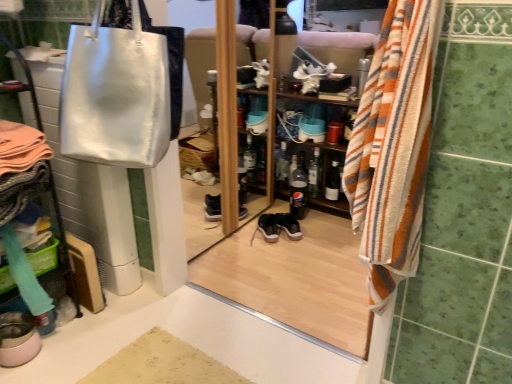
Question: Is the position of matte silver bag at upper left more distant than that of black glass bottle at center, the fourth bottle when ordered from left to right?

Choices:
 (A) yes
 (B) no

Answer: (B)

Question: Is matte silver bag at upper left to the left of black glass bottle at center, the fourth bottle when ordered from left to right, from the viewer's perspective?

Choices:
 (A) no
 (B) yes

Answer: (B)

Question: From the image's perspective, is matte silver bag at upper left on black glass bottle at center, the fourth bottle when ordered from left to right?

Choices:
 (A) no
 (B) yes

Answer: (A)

Question: From a real-world perspective, is matte silver bag at upper left positioned over black glass bottle at center, the first bottle viewed from the right, based on gravity?

Choices:
 (A) yes
 (B) no

Answer: (A)

Question: Can you confirm if matte silver bag at upper left is wider than black glass bottle at center, the first bottle viewed from the right?

Choices:
 (A) no
 (B) yes

Answer: (B)

Question: In the image, is clear glass bottle at center, the third bottle viewed from the left, on the left side or the right side of beige textured bath mat at lower center?

Choices:
 (A) right
 (B) left

Answer: (A)

Question: From the image's perspective, is clear glass bottle at center, the third bottle viewed from the left, located above or below beige textured bath mat at lower center?

Choices:
 (A) above
 (B) below

Answer: (A)

Question: Looking at their shapes, would you say clear glass bottle at center, which is the 2th bottle in right-to-left order, is wider or thinner than beige textured bath mat at lower center?

Choices:
 (A) thin
 (B) wide

Answer: (A)

Question: Is clear glass bottle at center, which is the 2th bottle in right-to-left order, taller or shorter than beige textured bath mat at lower center?

Choices:
 (A) short
 (B) tall

Answer: (B)

Question: From a real-world perspective, is clear glass bottle at center, which is the 2th bottle in right-to-left order, above or below clear glass bottle at center, placed as the fourth bottle when sorted from right to left?

Choices:
 (A) below
 (B) above

Answer: (A)

Question: In the image, is clear glass bottle at center, which is the 2th bottle in right-to-left order, on the left side or the right side of clear glass bottle at center, placed as the fourth bottle when sorted from right to left?

Choices:
 (A) left
 (B) right

Answer: (B)

Question: Based on their sizes in the image, would you say clear glass bottle at center, which is the 2th bottle in right-to-left order, is bigger or smaller than clear glass bottle at center, placed as the fourth bottle when sorted from right to left?

Choices:
 (A) big
 (B) small

Answer: (B)

Question: Relative to clear glass bottle at center, placed as the fourth bottle when sorted from right to left, is clear glass bottle at center, the third bottle viewed from the left, in front or behind?

Choices:
 (A) behind
 (B) front

Answer: (B)

Question: From the image's perspective, is matte silver bag at upper left above or below matte black sneakers at center, the 2th footwear from the front?

Choices:
 (A) below
 (B) above

Answer: (B)

Question: Is point (223, 249) closer or farther from the camera than point (285, 230)?

Choices:
 (A) farther
 (B) closer

Answer: (B)